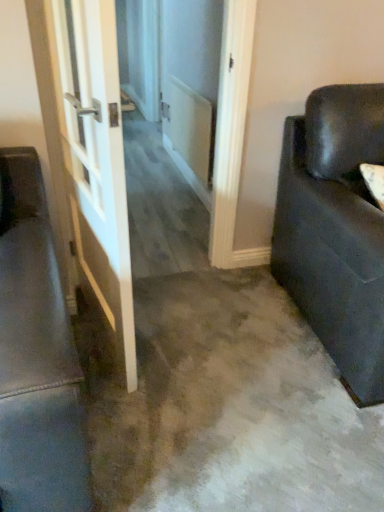
Question: From the image's perspective, relative to matte black couch at right, is white glossy door at left above or below?

Choices:
 (A) above
 (B) below

Answer: (A)

Question: Is point (124, 310) closer or farther from the camera than point (334, 281)?

Choices:
 (A) closer
 (B) farther

Answer: (A)

Question: Considering their positions, is white glossy door at left located in front of or behind matte black couch at right?

Choices:
 (A) front
 (B) behind

Answer: (A)

Question: Is point (347, 377) closer or farther from the camera than point (81, 178)?

Choices:
 (A) farther
 (B) closer

Answer: (B)

Question: In the image, is matte black couch at right on the left side or the right side of white glossy door at left?

Choices:
 (A) right
 (B) left

Answer: (A)

Question: In terms of width, does matte black couch at right look wider or thinner when compared to white glossy door at left?

Choices:
 (A) wide
 (B) thin

Answer: (A)

Question: From the image's perspective, relative to white glossy door at left, is matte black couch at right above or below?

Choices:
 (A) below
 (B) above

Answer: (A)